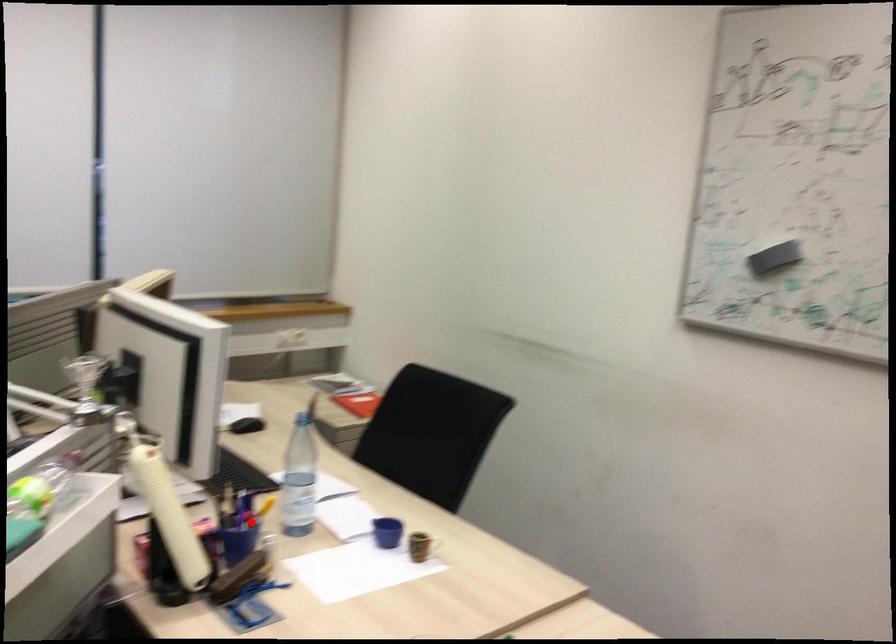
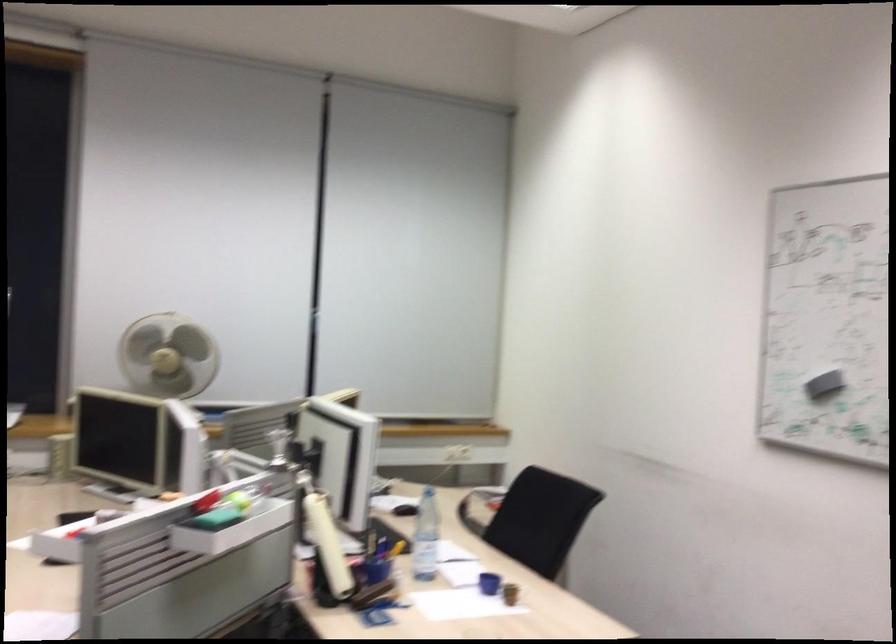
Question: I am providing you with two images of the same scene from different viewpoints. Image1 has a red point marked. In image2, the corresponding 3D location appears at what relative position? Reply with the corresponding letter.

Choices:
 (A) Closer
 (B) Farther

Answer: (B)